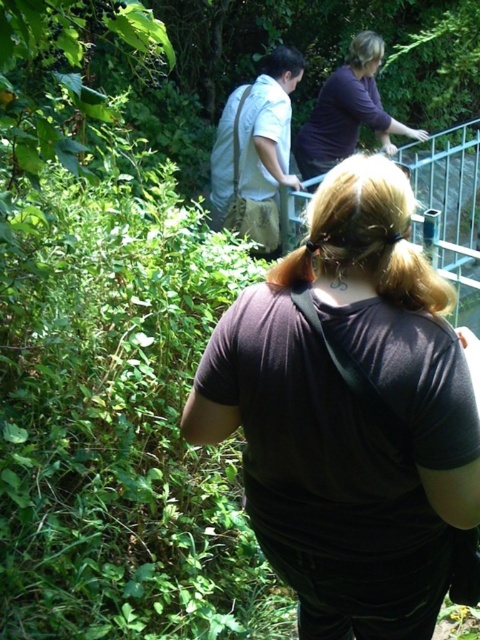
Question: Which point is farther to the camera?

Choices:
 (A) dark purple shirt at upper center
 (B) dark brown fabric at center

Answer: (A)

Question: Does dark brown fabric at center appear under dark purple shirt at upper center?

Choices:
 (A) yes
 (B) no

Answer: (A)

Question: Is dark brown fabric at center behind dark purple shirt at upper center?

Choices:
 (A) yes
 (B) no

Answer: (B)

Question: Where is dark brown fabric at center located in relation to dark purple shirt at upper center in the image?

Choices:
 (A) below
 (B) above

Answer: (A)